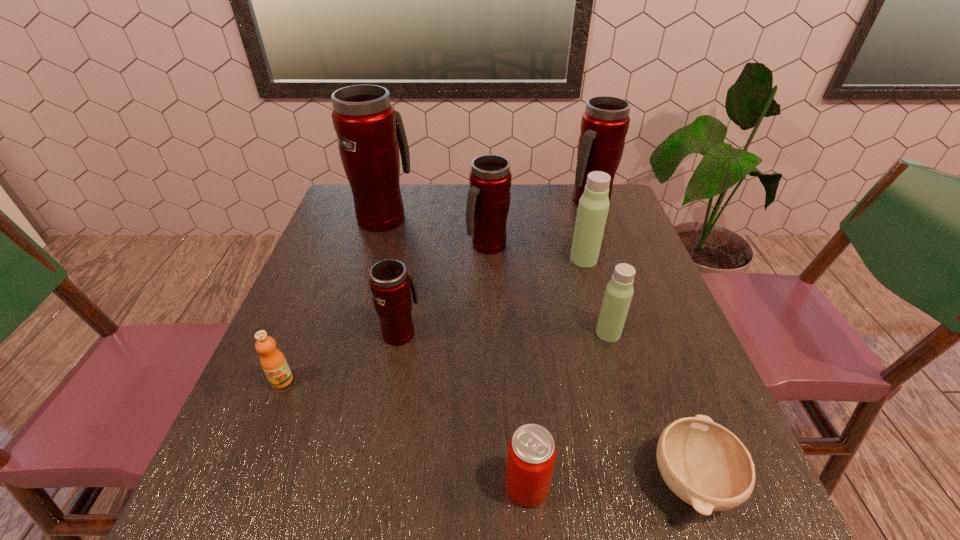
Where is `thermos bottle that is the sixth closest to the can`? This screenshot has width=960, height=540. thermos bottle that is the sixth closest to the can is located at coordinates (604, 125).

Locate an element on the screen. The width and height of the screenshot is (960, 540). the fifth closest thermos bottle relative to the tallest object is located at coordinates (619, 291).

Where is `the second closest red thermos bottle to the smallest red thermos bottle`? the second closest red thermos bottle to the smallest red thermos bottle is located at coordinates (370, 133).

Choose which red thermos bottle is the second nearest neighbor to the nearest red thermos bottle. Please provide its 2D coordinates. Your answer should be formatted as a tuple, i.e. [(x, y)], where the tuple contains the x and y coordinates of a point satisfying the conditions above.

[(370, 133)]

Identify the location of free space that satisfies the following two spatial constraints: 1. on the side with the handle of the second biggest red thermos bottle; 2. on the left side of the bowl. (x=687, y=480).

At what (x,y) coordinates should I click in order to perform the action: click on vacant space that satisfies the following two spatial constraints: 1. on the front label of the beige bowl; 2. on the left side of the leftmost object. Please return your answer as a coordinate pair (x, y). This screenshot has height=540, width=960. Looking at the image, I should click on (241, 480).

You are a GUI agent. You are given a task and a screenshot of the screen. Output one action in this format:
    pyautogui.click(x=<x>, y=<y>)
    Task: Click on the free point that satisfies the following two spatial constraints: 1. on the front label of the seventh farthest object; 2. on the right side of the can
    This screenshot has width=960, height=540.
    Given the screenshot: What is the action you would take?
    pyautogui.click(x=239, y=486)

This screenshot has height=540, width=960. I want to click on free region that satisfies the following two spatial constraints: 1. on the side with the handle of the bowl; 2. on the right side of the third thermos bottle from left to right, so click(x=492, y=480).